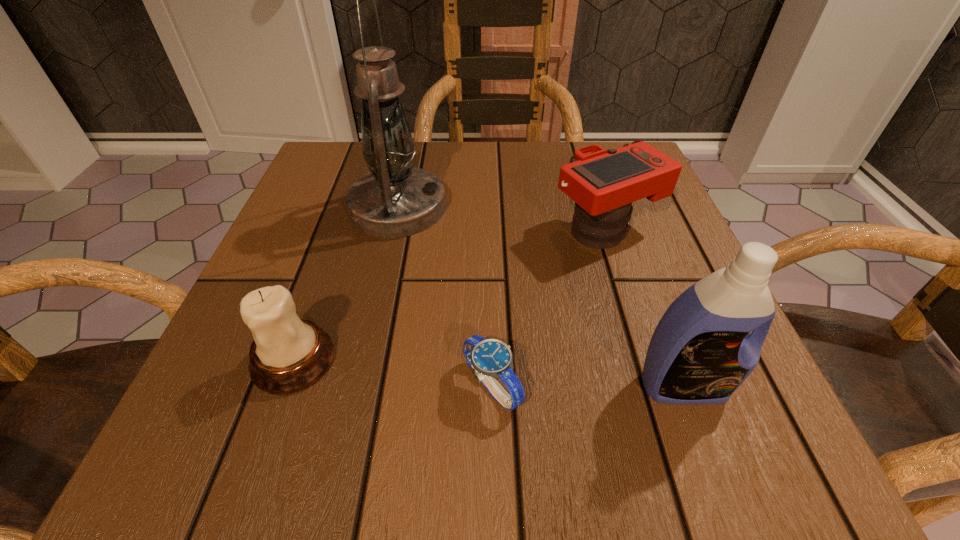
The width and height of the screenshot is (960, 540). In order to click on the tallest object in this screenshot , I will do (x=396, y=199).

Locate an element on the screen. The width and height of the screenshot is (960, 540). the second tallest object is located at coordinates (701, 351).

Find the location of a particular element. The width and height of the screenshot is (960, 540). camera is located at coordinates (603, 184).

At what (x,y) coordinates should I click in order to perform the action: click on candle holder. Please return your answer as a coordinate pair (x, y). Looking at the image, I should click on (289, 354).

The image size is (960, 540). I want to click on the third object from left to right, so click(x=489, y=358).

The width and height of the screenshot is (960, 540). I want to click on the shortest object, so click(x=489, y=358).

Where is `free spot located on the right of the tallest object`? The height and width of the screenshot is (540, 960). free spot located on the right of the tallest object is located at coordinates (643, 207).

Locate an element on the screen. This screenshot has width=960, height=540. blank space located on the back of the detergent is located at coordinates (631, 243).

Image resolution: width=960 pixels, height=540 pixels. Find the location of `vacant space located 0.110m on the front of the camera`. vacant space located 0.110m on the front of the camera is located at coordinates (632, 308).

I want to click on free location located 0.080m on the back of the candle holder, so click(x=319, y=289).